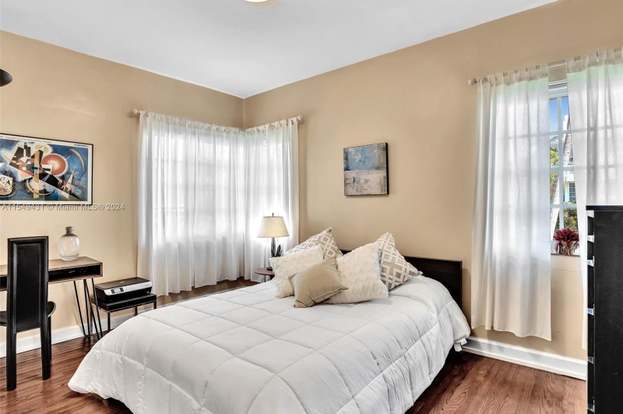
This screenshot has height=414, width=623. Identify the location of curtain panels. (167, 190), (212, 192), (270, 184), (508, 182), (604, 155).